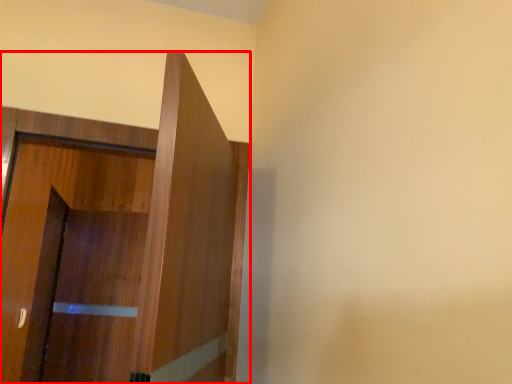
Question: From the image's perspective, what is the correct spatial relationship of door (annotated by the red box) in relation to screen door?

Choices:
 (A) below
 (B) above

Answer: (B)